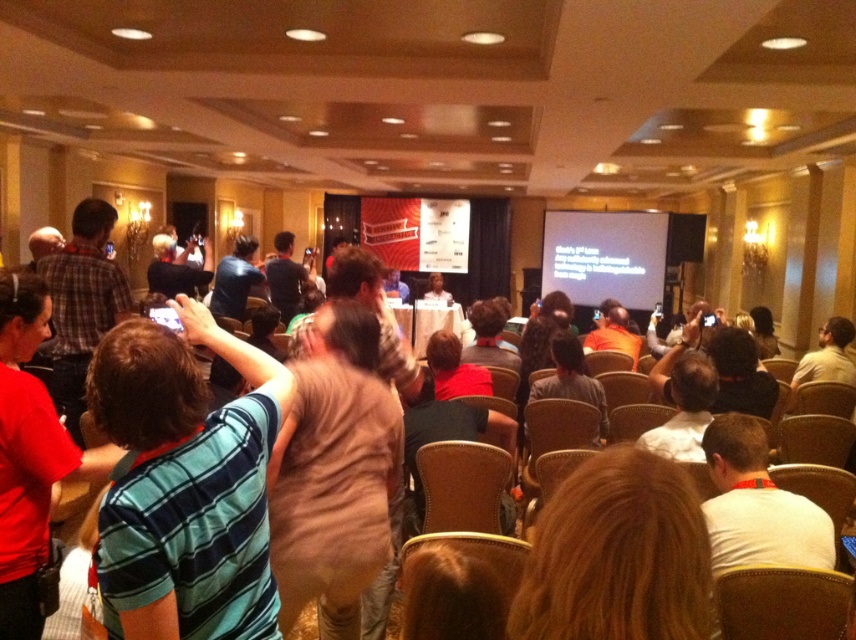
You are a photographer at the event and want to capture both the matte red shirt at center and the blue striped shirt at center in a single frame. Which shirt should you focus on to ensure both are in the frame without cropping?

The matte red shirt at center is smaller than the blue striped shirt at center, so focusing on the blue striped shirt at center will allow both shirts to fit within the frame since it takes up more space.

You are an event planner observing the audience. You notice two attendees wearing a red shirt at left and a light beige shirt at center. Which attendee is standing taller?

The red shirt at left is taller than the light beige shirt at center.